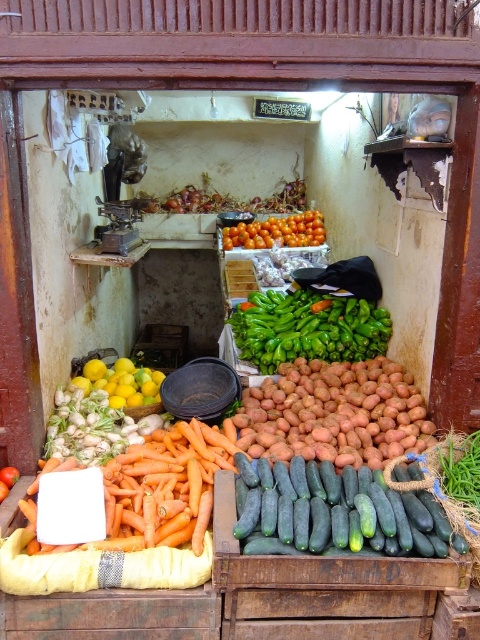
Is green smooth cucumber at center behind orange matte tomatoes at center?

No, it is in front of orange matte tomatoes at center.

Is point (252, 516) farther from camera compared to point (223, 234)?

No, it is in front of (223, 234).

I want to click on green smooth cucumber at center, so [336, 513].

Is smooth orange potatoes at center positioned at the back of yellow matte lemons at center?

That is False.

Is point (416, 426) closer to camera compared to point (120, 406)?

Yes, point (416, 426) is in front of point (120, 406).

Does point (296, 372) come in front of point (108, 404)?

No, (296, 372) is behind (108, 404).

Identify the location of smooth orange potatoes at center. This screenshot has width=480, height=640. (335, 413).

Between orange matte carrots at center and orange matte tomatoes at center, which one appears on the left side from the viewer's perspective?

From the viewer's perspective, orange matte carrots at center appears more on the left side.

In the scene shown: Between orange matte carrots at center and orange matte tomatoes at center, which one is positioned higher?

Positioned higher is orange matte tomatoes at center.

Which is behind, point (152, 480) or point (320, 227)?

The point (320, 227) is more distant.

Locate an element on the screen. orange matte carrots at center is located at coordinates (166, 484).